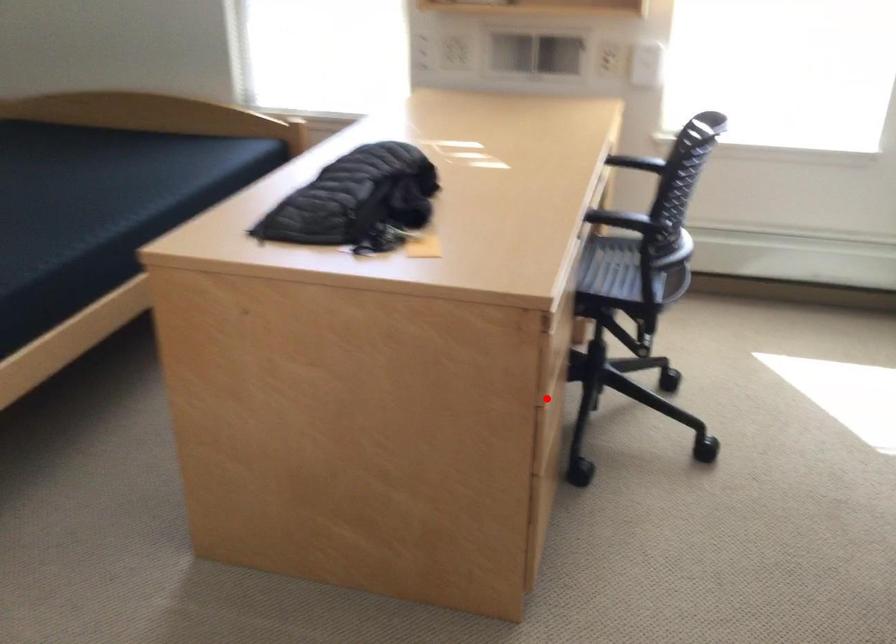
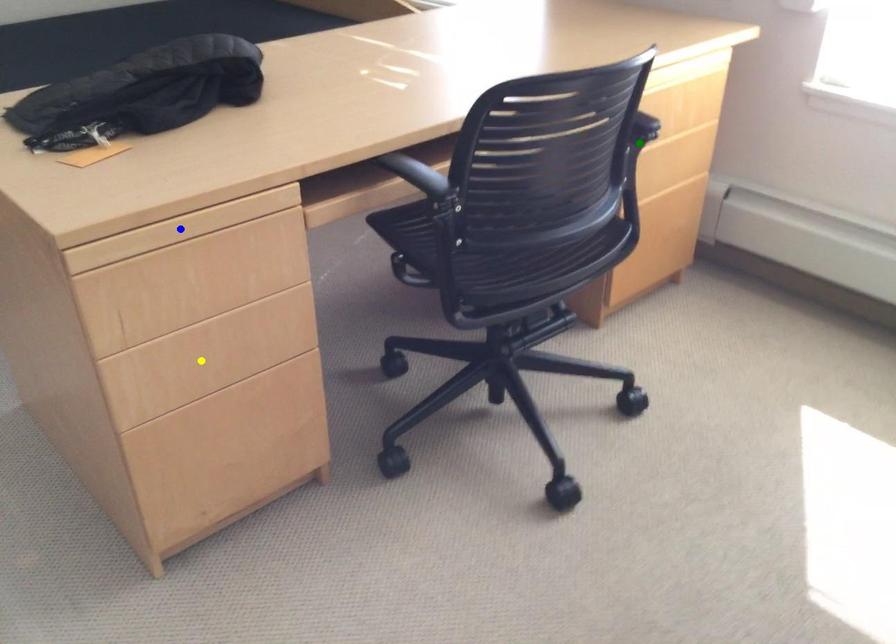
Question: I am providing you with two images of the same scene from different viewpoints. A red point is marked on the first image. You are given multiple points on the second image. In image 2, which mark is for the same physical point as the one in image 1?

Choices:
 (A) green point
 (B) blue point
 (C) yellow point

Answer: (C)